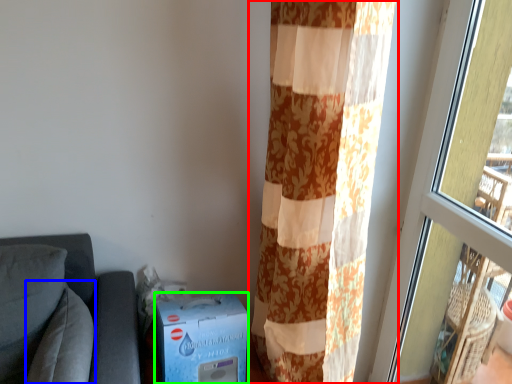
Question: Based on their relative distances, which object is nearer to curtain (highlighted by a red box)? Choose from pillow (highlighted by a blue box) and cardboard box (highlighted by a green box).

Choices:
 (A) pillow
 (B) cardboard box

Answer: (B)